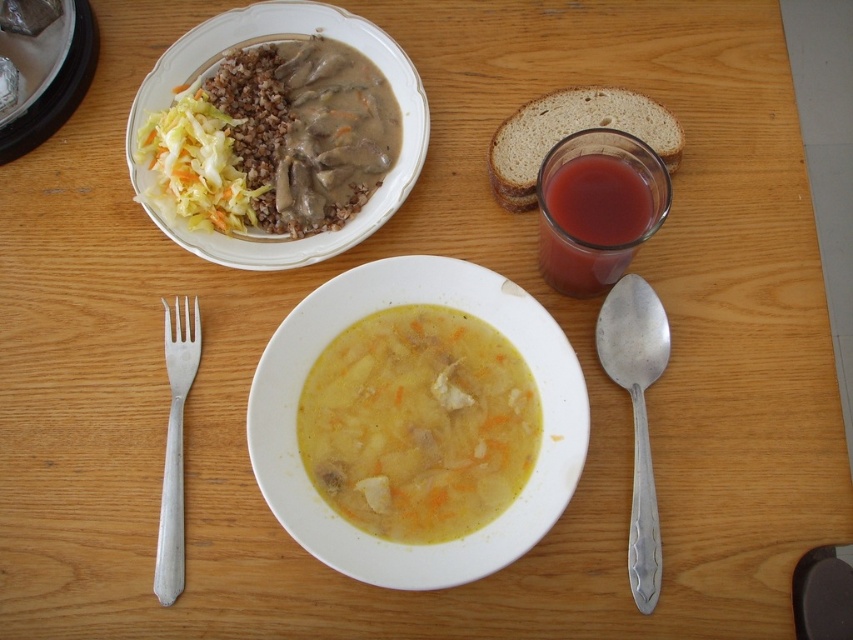
Question: Which object is the closest to the yellow matte soup at center?

Choices:
 (A) silver metallic fork at lower left
 (B) brown textured bread at upper right
 (C) matte brown rice at upper left
 (D) translucent glass juice at upper right

Answer: (D)

Question: Which of the following is the closest to the observer?

Choices:
 (A) (164, 508)
 (B) (637, 605)
 (C) (361, 104)

Answer: (B)

Question: Does matte brown rice at upper left appear over silver metallic fork at lower left?

Choices:
 (A) no
 (B) yes

Answer: (B)

Question: Estimate the real-world distances between objects in this image. Which object is closer to the silver metallic spoon at right?

Choices:
 (A) matte brown rice at upper left
 (B) silver metallic fork at lower left
 (C) yellow matte soup at center

Answer: (C)

Question: Is translucent glass juice at upper right positioned before silver metallic fork at lower left?

Choices:
 (A) yes
 (B) no

Answer: (A)

Question: Does translucent glass juice at upper right lie behind silver metallic spoon at right?

Choices:
 (A) yes
 (B) no

Answer: (B)